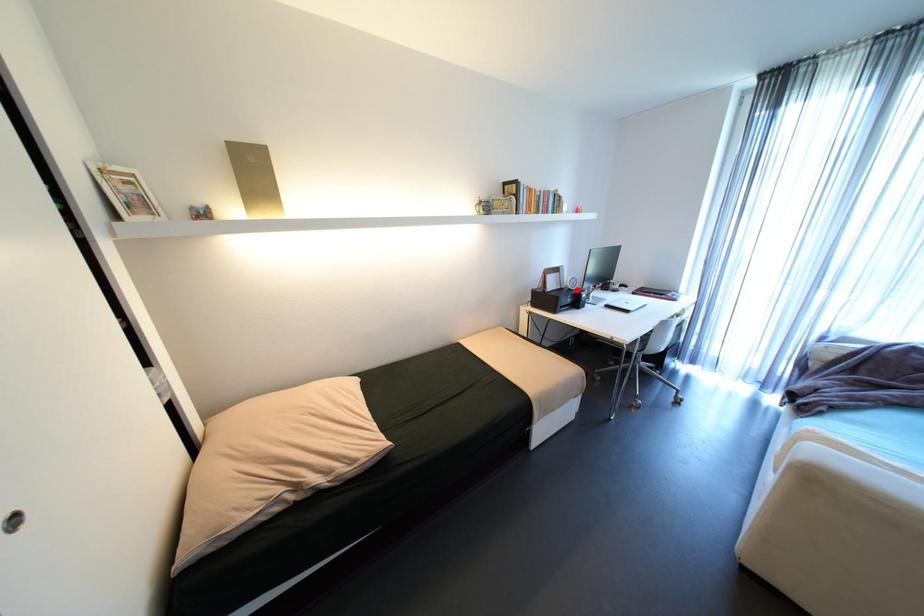
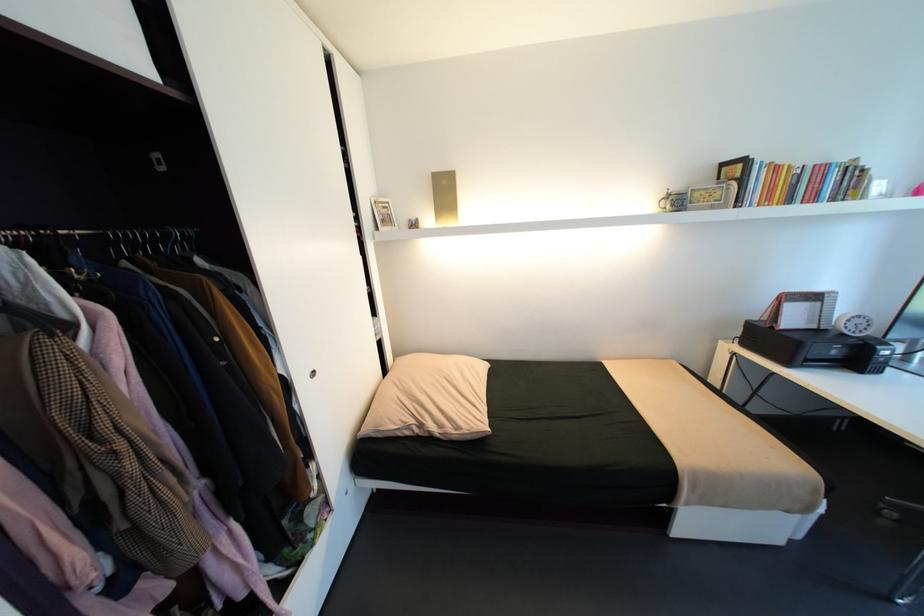
Question: I am providing you with two images of the same scene from different viewpoints. A red point is marked on the first image. Is the red point's position out of view in image 2?

Choices:
 (A) Yes
 (B) No

Answer: (B)